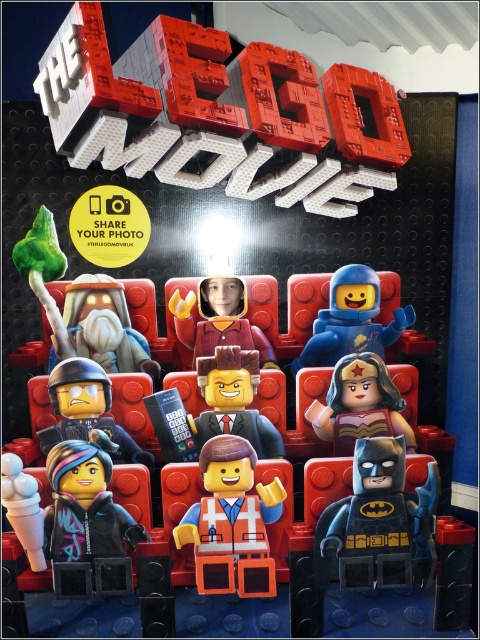
Question: Is blue matte astronaut at center further to the viewer compared to smooth brown minifigure at center?

Choices:
 (A) no
 (B) yes

Answer: (B)

Question: Estimate the real-world distances between objects in this image. Which object is closer to the blue matte astronaut at center?

Choices:
 (A) smooth brown minifigure at center
 (B) matte red minifigure at center
 (C) shiny gold armor at center
 (D) matte gray beard at center

Answer: (B)

Question: Is orange matte vest at center further to the viewer compared to smooth brown minifigure at center?

Choices:
 (A) no
 (B) yes

Answer: (A)

Question: Which of these objects is positioned closest to the blue matte astronaut at center?

Choices:
 (A) matte gray beard at center
 (B) matte red minifigure at center

Answer: (B)

Question: Is matte gray beard at center smaller than smooth brown minifigure at center?

Choices:
 (A) no
 (B) yes

Answer: (A)

Question: Which point is closer to the camera?

Choices:
 (A) (317, 403)
 (B) (251, 481)
 (C) (147, 113)
 (D) (241, 292)

Answer: (B)